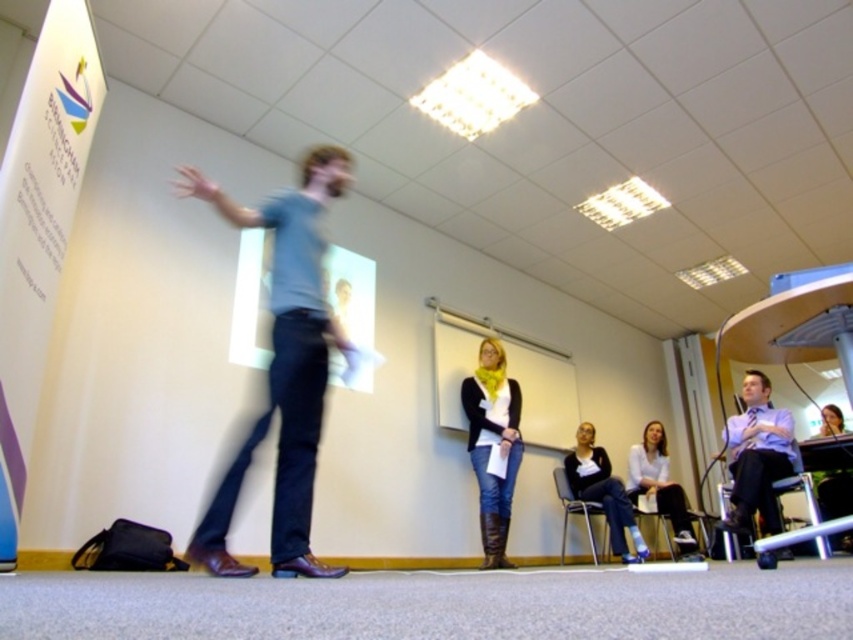
Question: Does light blue shirt at right appear over light blue jeans at lower center?

Choices:
 (A) yes
 (B) no

Answer: (A)

Question: Which point appears farthest from the camera in this image?

Choices:
 (A) (619, 497)
 (B) (637, 458)

Answer: (B)

Question: Among these objects, which one is nearest to the camera?

Choices:
 (A) light blue shirt at right
 (B) white glossy projection screen at center
 (C) light blue jeans at lower center

Answer: (B)

Question: In this image, where is light blue shirt at right located relative to white shirt at lower right?

Choices:
 (A) left
 (B) right

Answer: (B)

Question: Estimate the real-world distances between objects in this image. Which object is closer to the green fabric chair at lower right?

Choices:
 (A) blue cotton shirt at center
 (B) white glossy projection screen at center
 (C) denim jeans at center
 (D) white shirt at lower right

Answer: (D)

Question: Is blue cotton shirt at center positioned before light blue shirt at right?

Choices:
 (A) yes
 (B) no

Answer: (A)